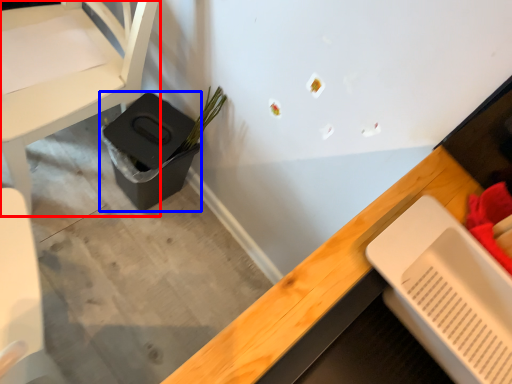
Question: Which object is closer to the camera taking this photo, chair (highlighted by a red box) or potty (highlighted by a blue box)?

Choices:
 (A) chair
 (B) potty

Answer: (A)